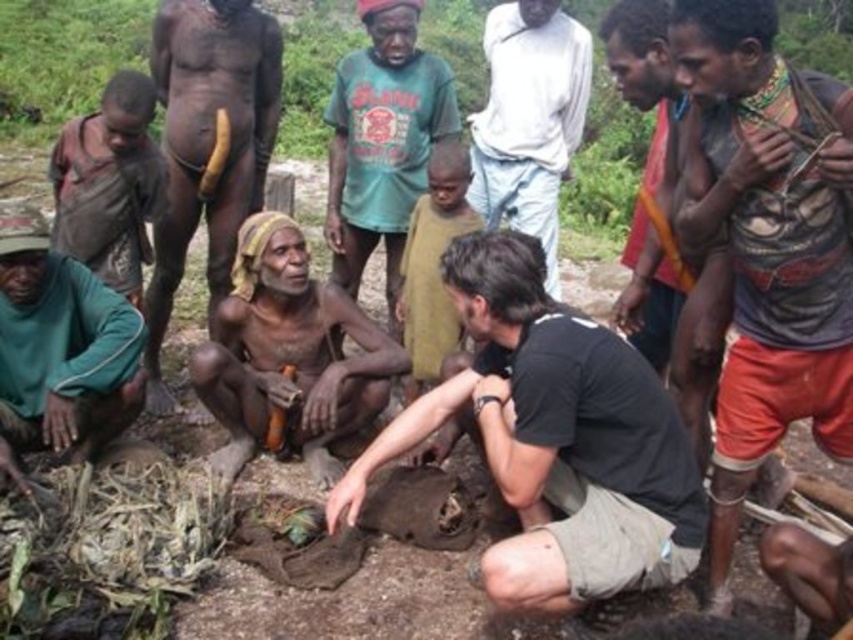
Is brown rough skin at center further to the viewer compared to brown skin man at center?

No, it is in front of brown skin man at center.

Does brown rough skin at center appear on the right side of brown skin man at center?

Yes, brown rough skin at center is to the right of brown skin man at center.

Does point (247, 420) lie behind point (276, 108)?

No, it is not.

The width and height of the screenshot is (853, 640). I want to click on brown rough skin at center, so click(288, 355).

Who is taller, brown skin man at center or green fabric pants at lower left?

brown skin man at center is taller.

The height and width of the screenshot is (640, 853). In order to click on brown skin man at center in this screenshot , I will do `click(207, 145)`.

Can you confirm if green fabric pants at lower left is bigger than white cotton shirt at upper center?

No, green fabric pants at lower left is not bigger than white cotton shirt at upper center.

Which is in front, point (28, 314) or point (555, 188)?

Point (28, 314) is more forward.

This screenshot has width=853, height=640. Identify the location of green fabric pants at lower left. (59, 348).